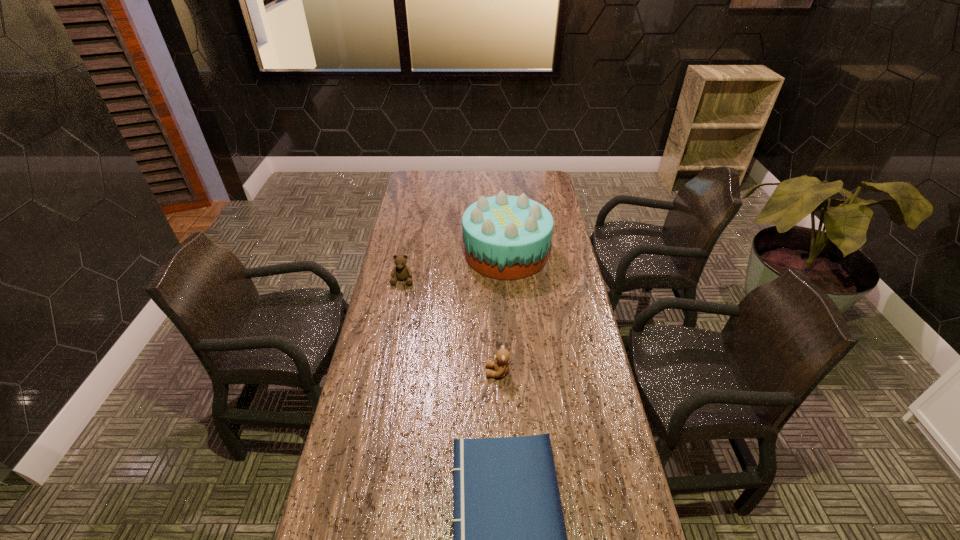
Locate an element on the screen. This screenshot has height=540, width=960. free space between the nearer teddy bear and the tallest object is located at coordinates (502, 313).

Locate an element on the screen. The image size is (960, 540). the closest object to the leftmost object is located at coordinates (506, 237).

Point out which object is positioned as the second nearest to the nearest object. Please provide its 2D coordinates. Your answer should be formatted as a tuple, i.e. [(x, y)], where the tuple contains the x and y coordinates of a point satisfying the conditions above.

[(402, 272)]